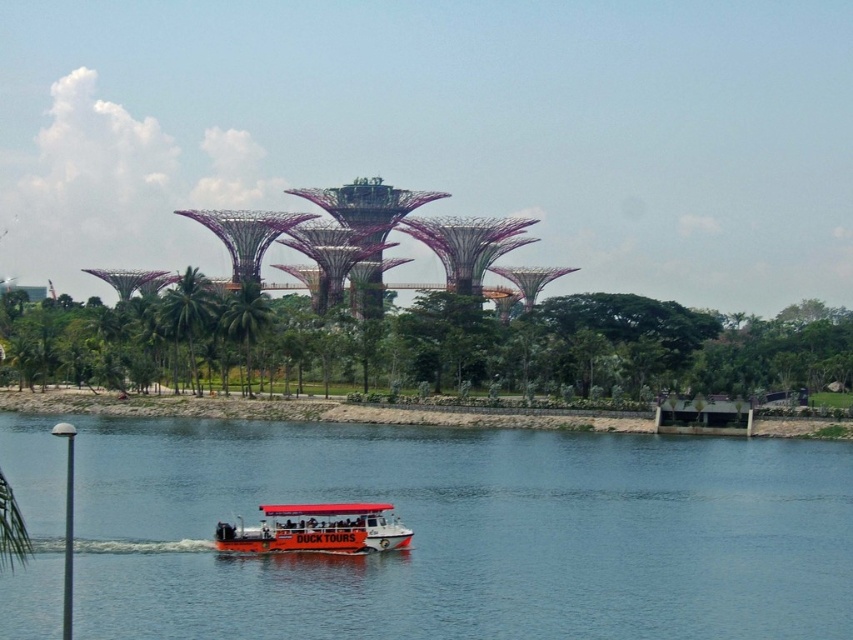
You are standing at the edge of the water where the red and white amphibious vehicle is located. Looking towards the Supertrees, where are the green leafy trees at center in relation to your position?

The green leafy trees at center are located at point 0.541 on the x axis and 0.504 on the y axis relative to your position.

You are standing in the Gardens by the Bay and want to take a photo of the DUCK TOURS amphibious vehicle. You notice two points marked on your map at coordinates point (234, 360) and point (253, 321). Which point should you stand at to ensure the vehicle is closer to you in the photo?

You should stand at point (234, 360) because it is further to the camera than point (253, 321), making the DUCK TOURS amphibious vehicle appear closer in the photo.